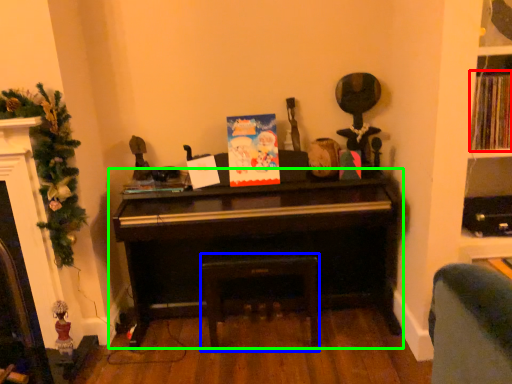
Question: Considering the real-world distances, which object is farthest from book (highlighted by a red box)? stool (highlighted by a blue box) or piano (highlighted by a green box)?

Choices:
 (A) stool
 (B) piano

Answer: (A)